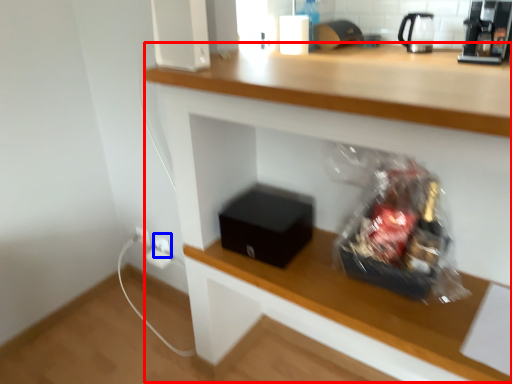
Question: Which point is further to the camera, computer desk (highlighted by a red box) or electric outlet (highlighted by a blue box)?

Choices:
 (A) computer desk
 (B) electric outlet

Answer: (B)